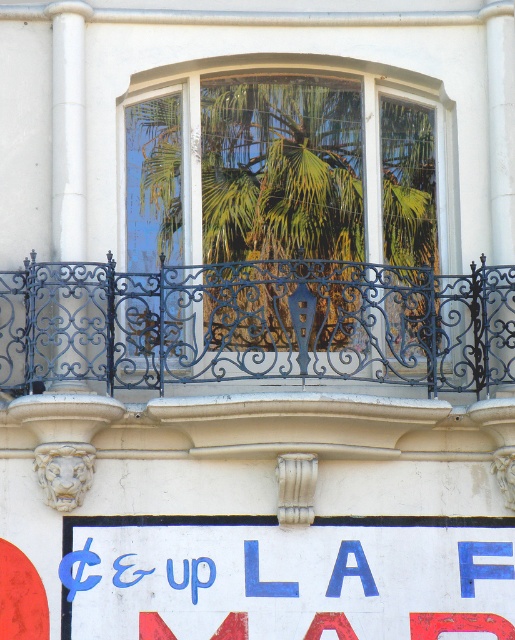
Question: Is clear glass window at center further to the viewer compared to white painted signboard at lower center?

Choices:
 (A) no
 (B) yes

Answer: (B)

Question: Based on their relative distances, which object is nearer to the white painted signboard at lower center?

Choices:
 (A) clear glass window at center
 (B) black wrought iron balcony at center

Answer: (B)

Question: Does clear glass window at center have a larger size compared to black wrought iron balcony at center?

Choices:
 (A) yes
 (B) no

Answer: (A)

Question: Which of the following is the closest to the observer?

Choices:
 (A) white painted signboard at lower center
 (B) clear glass window at center

Answer: (A)

Question: Which of the following is the closest to the observer?

Choices:
 (A) clear glass window at center
 (B) white painted signboard at lower center

Answer: (B)

Question: Is black wrought iron balcony at center below white painted signboard at lower center?

Choices:
 (A) yes
 (B) no

Answer: (B)